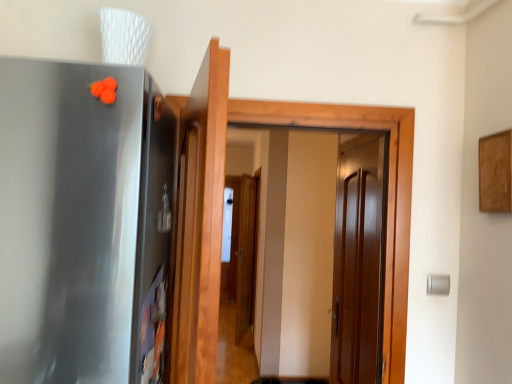
Question: Would you say glossy wood door at center, the 2th door from the front, is inside or outside wooden door at center, the first door from the front?

Choices:
 (A) inside
 (B) outside

Answer: (B)

Question: Based on their sizes in the image, would you say glossy wood door at center, arranged as the second door when viewed from the left, is bigger or smaller than wooden door at center, the first door from the front?

Choices:
 (A) big
 (B) small

Answer: (B)

Question: Which of these objects is positioned closest to the wooden door at center, the first door from the front?

Choices:
 (A) glossy wood door at center, the 2th door from the front
 (B) satin metallic refrigerator at left

Answer: (B)

Question: Which object is the closest to the satin metallic refrigerator at left?

Choices:
 (A) glossy wood door at center, the first door when ordered from right to left
 (B) wooden door at center, the first door from the front

Answer: (B)